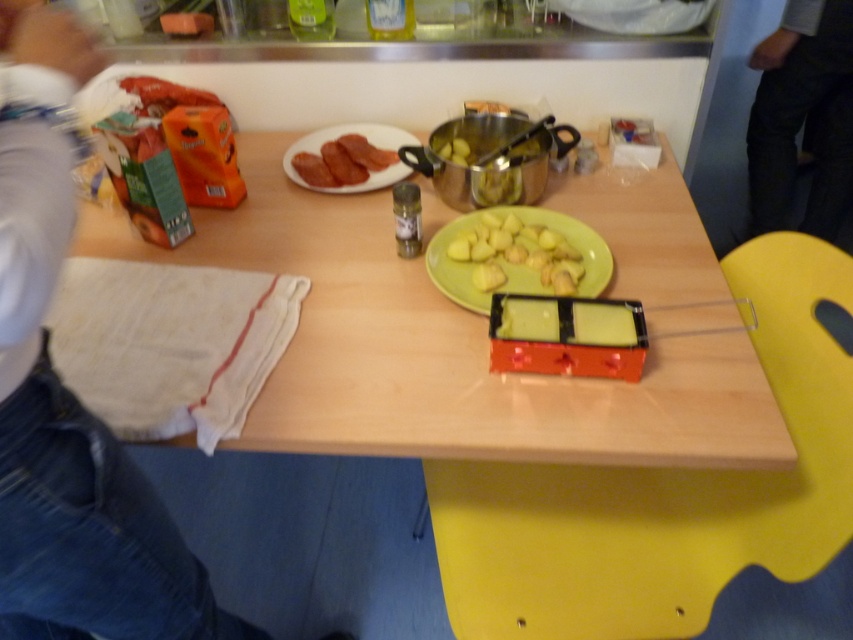
Is dark gray pants at right below matte white plate at upper center?

No, dark gray pants at right is not below matte white plate at upper center.

What do you see at coordinates (802, 116) in the screenshot? The height and width of the screenshot is (640, 853). I see `dark gray pants at right` at bounding box center [802, 116].

Where is `dark gray pants at right`? dark gray pants at right is located at coordinates (802, 116).

Can you confirm if yellow matte potatoes at center is positioned to the left of matte white plate at upper center?

In fact, yellow matte potatoes at center is to the right of matte white plate at upper center.

Who is lower down, yellow matte potatoes at center or matte white plate at upper center?

yellow matte potatoes at center is below.

Find the location of a particular element. The width and height of the screenshot is (853, 640). yellow matte potatoes at center is located at coordinates (515, 253).

You are a GUI agent. You are given a task and a screenshot of the screen. Output one action in this format:
    pyautogui.click(x=<x>, y=<y>)
    Task: Click on the yellow matte potatoes at center
    The height and width of the screenshot is (640, 853).
    Given the screenshot: What is the action you would take?
    pyautogui.click(x=515, y=253)

Who is positioned more to the right, wooden table at center or matte white plate at upper center?

From the viewer's perspective, wooden table at center appears more on the right side.

Who is higher up, wooden table at center or matte white plate at upper center?

matte white plate at upper center is above.

Where is `wooden table at center`? The height and width of the screenshot is (640, 853). wooden table at center is located at coordinates (447, 349).

At what (x,y) coordinates should I click in order to perform the action: click on wooden table at center. Please return your answer as a coordinate pair (x, y). Image resolution: width=853 pixels, height=640 pixels. Looking at the image, I should click on (447, 349).